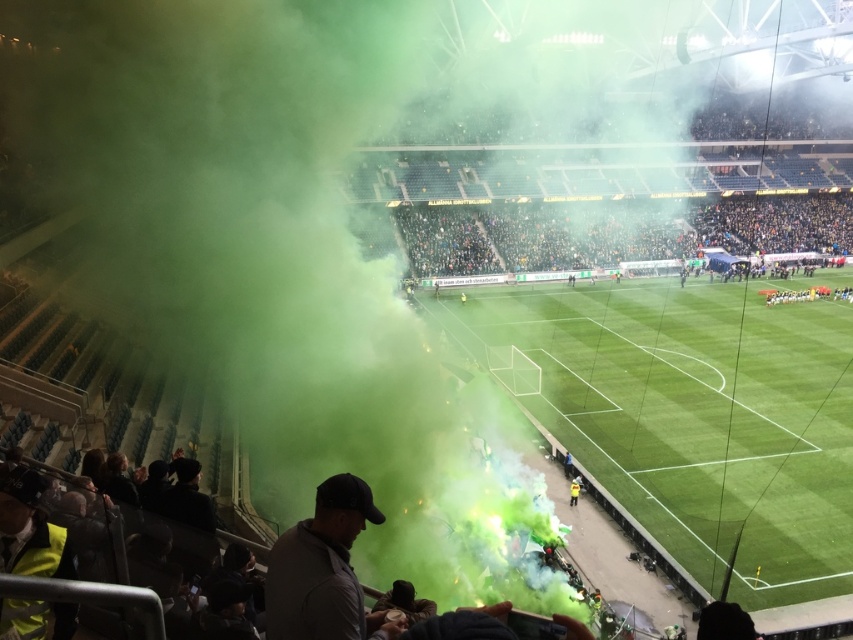
In the scene shown: You are a spectator sitting in the stands of the soccer stadium. You notice the green smoke at left billowing towards the field. If the smoke spreads 5 meters per minute, how many minutes will it take for the smoke to reach the field?

The green smoke at left is 20.34 meters away from the viewer. Since the smoke spreads at 5 meters per minute, it will take approximately 4.07 minutes for the smoke to reach the field.

You are a drone operator trying to capture a clear aerial view of the soccer field. There is a green smoke at left located at point (248, 230). Where should you position your drone to avoid the smoke and get a clear shot of the field?

The green smoke at left is located at point (248, 230). To avoid it, position the drone away from that coordinate, perhaps to the right side of the field where the smoke isn